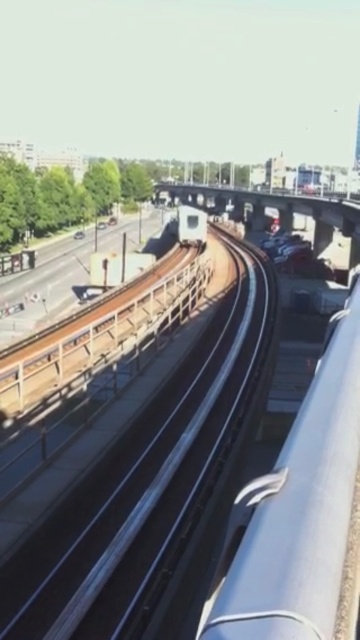
Question: Is smooth steel train track at center thinner than white glossy train at center?

Choices:
 (A) no
 (B) yes

Answer: (B)

Question: Is smooth steel train track at center to the left of white glossy train at center from the viewer's perspective?

Choices:
 (A) no
 (B) yes

Answer: (B)

Question: Is smooth steel train track at center to the left of white glossy train at center from the viewer's perspective?

Choices:
 (A) yes
 (B) no

Answer: (A)

Question: Which object is closer to the camera taking this photo?

Choices:
 (A) smooth steel train track at center
 (B) white glossy train at center

Answer: (A)